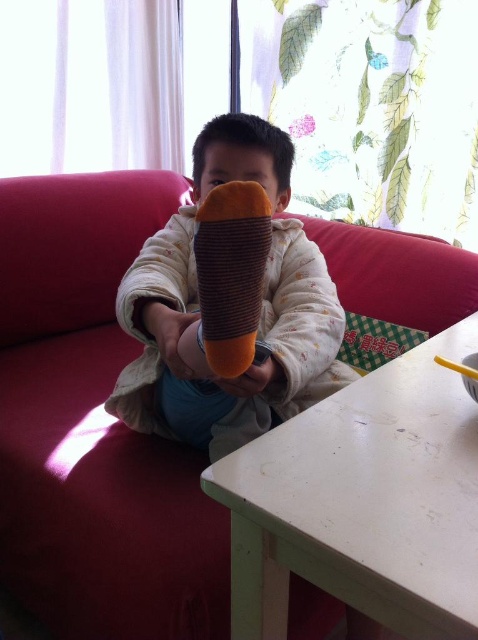
Question: Estimate the real-world distances between objects in this image. Which object is closer to the brown textured sock at center?

Choices:
 (A) soft plush toy at center
 (B) white matte table at lower center

Answer: (B)

Question: Can you confirm if white matte table at lower center is thinner than brown textured sock at center?

Choices:
 (A) yes
 (B) no

Answer: (B)

Question: Does white matte table at lower center have a greater width compared to brown textured sock at center?

Choices:
 (A) yes
 (B) no

Answer: (A)

Question: Considering the real-world distances, which object is closest to the soft plush toy at center?

Choices:
 (A) velvet-like red couch at center
 (B) white matte table at lower center
 (C) brown textured sock at center

Answer: (B)

Question: Where is velvet-like red couch at center located in relation to brown textured sock at center in the image?

Choices:
 (A) above
 (B) below

Answer: (B)

Question: Which point is farther to the camera?

Choices:
 (A) (292, 387)
 (B) (347, 588)
 (C) (227, 236)
 (D) (160, 618)

Answer: (D)